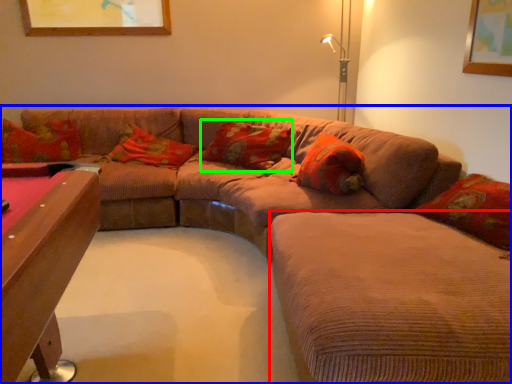
Question: Estimate the real-world distances between objects in this image. Which object is closer to couch (highlighted by a red box), studio couch (highlighted by a blue box) or pillow (highlighted by a green box)?

Choices:
 (A) studio couch
 (B) pillow

Answer: (A)